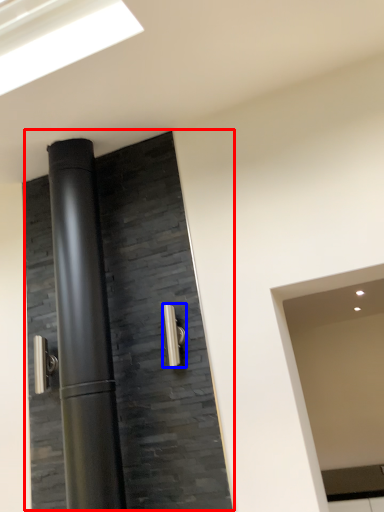
Question: Which object is further to the camera taking this photo, door (highlighted by a red box) or door handle (highlighted by a blue box)?

Choices:
 (A) door
 (B) door handle

Answer: (B)